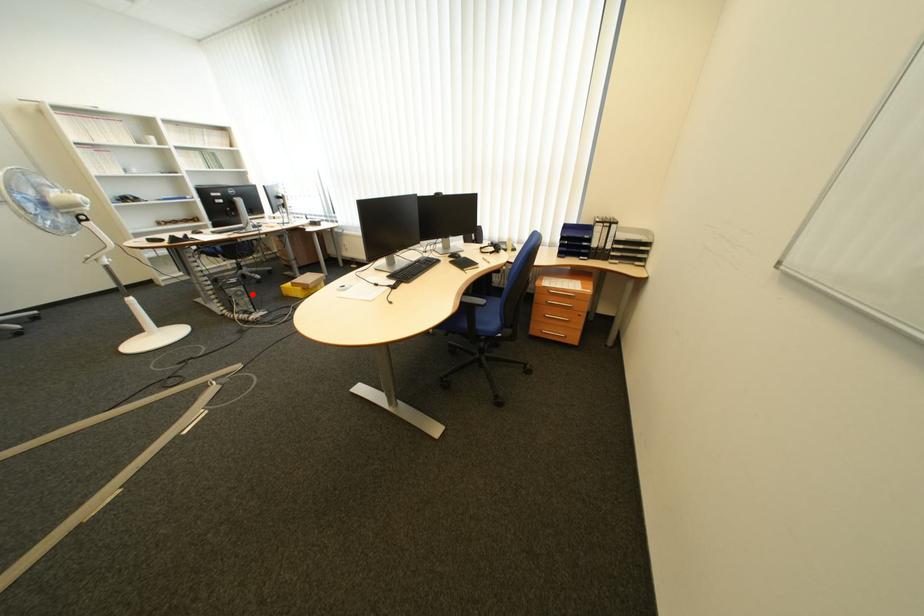
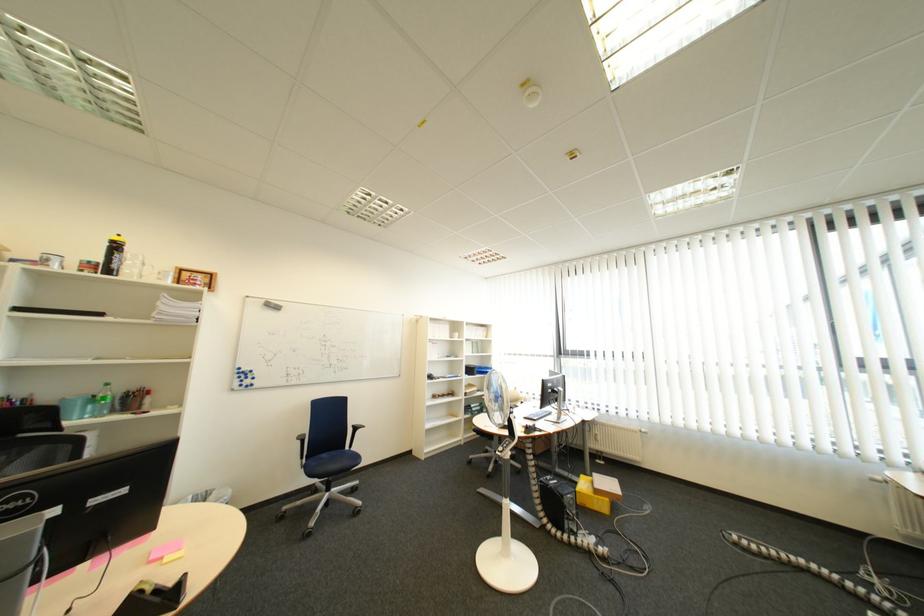
Question: I am providing you with two images of the same scene from different viewpoints. In image1, a red point is highlighted. Considering the same 3D point in image2, which of the following is correct?

Choices:
 (A) It is closer
 (B) It is farther

Answer: (B)